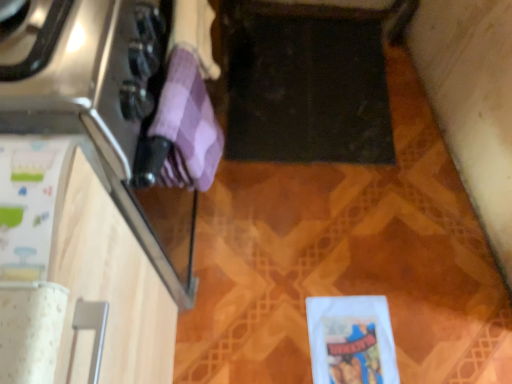
Question: From a real-world perspective, is white matte wrapping paper at lower right, which is counted as the 3th wrapping paper, starting from the front, located higher than purple checkered towel at left, which appears as the 2th wrapping paper when viewed from the right?

Choices:
 (A) no
 (B) yes

Answer: (A)

Question: Is white matte wrapping paper at lower right, marked as the 1th wrapping paper in a bottom-to-top arrangement, bigger than purple checkered towel at left, positioned as the 1th wrapping paper in top-to-bottom order?

Choices:
 (A) no
 (B) yes

Answer: (A)

Question: Is purple checkered towel at left, positioned as the 1th wrapping paper in top-to-bottom order, at the back of white matte wrapping paper at lower right, the 3th wrapping paper from the left?

Choices:
 (A) yes
 (B) no

Answer: (B)

Question: Is white matte wrapping paper at lower right, the 3th wrapping paper from the left, next to purple checkered towel at left, which is the second wrapping paper from back to front, and touching it?

Choices:
 (A) yes
 (B) no

Answer: (B)

Question: From the image's perspective, is white matte wrapping paper at lower right, placed as the first wrapping paper when sorted from right to left, below purple checkered towel at left, which is the 3th wrapping paper in bottom-to-top order?

Choices:
 (A) no
 (B) yes

Answer: (B)

Question: Is white matte wrapping paper at lower right, marked as the 1th wrapping paper in a bottom-to-top arrangement, closer to the viewer compared to purple checkered towel at left, which is the 3th wrapping paper in bottom-to-top order?

Choices:
 (A) no
 (B) yes

Answer: (A)

Question: Is white paper at left, which appears as the 2th wrapping paper when ordered from the bottom, taller than white matte wrapping paper at lower right, the 3th wrapping paper from the left?

Choices:
 (A) yes
 (B) no

Answer: (A)

Question: Can you confirm if white paper at left, the third wrapping paper in the right-to-left sequence, is thinner than white matte wrapping paper at lower right, which is the 3th wrapping paper from top to bottom?

Choices:
 (A) yes
 (B) no

Answer: (B)

Question: Is white paper at left, which appears as the 2th wrapping paper when ordered from the bottom, positioned beyond the bounds of white matte wrapping paper at lower right, which is counted as the 3th wrapping paper, starting from the front?

Choices:
 (A) no
 (B) yes

Answer: (B)

Question: Is white paper at left, the third wrapping paper in the right-to-left sequence, at the left side of white matte wrapping paper at lower right, marked as the 1th wrapping paper in a bottom-to-top arrangement?

Choices:
 (A) no
 (B) yes

Answer: (B)

Question: Is white paper at left, marked as the 1th wrapping paper in a left-to-right arrangement, placed right next to white matte wrapping paper at lower right, which is counted as the 3th wrapping paper, starting from the front?

Choices:
 (A) yes
 (B) no

Answer: (B)

Question: From the image's perspective, is white paper at left, the third wrapping paper in the right-to-left sequence, located above white matte wrapping paper at lower right, positioned as the first wrapping paper in back-to-front order?

Choices:
 (A) no
 (B) yes

Answer: (B)

Question: Is white matte wrapping paper at lower right, marked as the 1th wrapping paper in a bottom-to-top arrangement, at the left side of white paper at left, which appears as the 2th wrapping paper when ordered from the bottom?

Choices:
 (A) no
 (B) yes

Answer: (A)